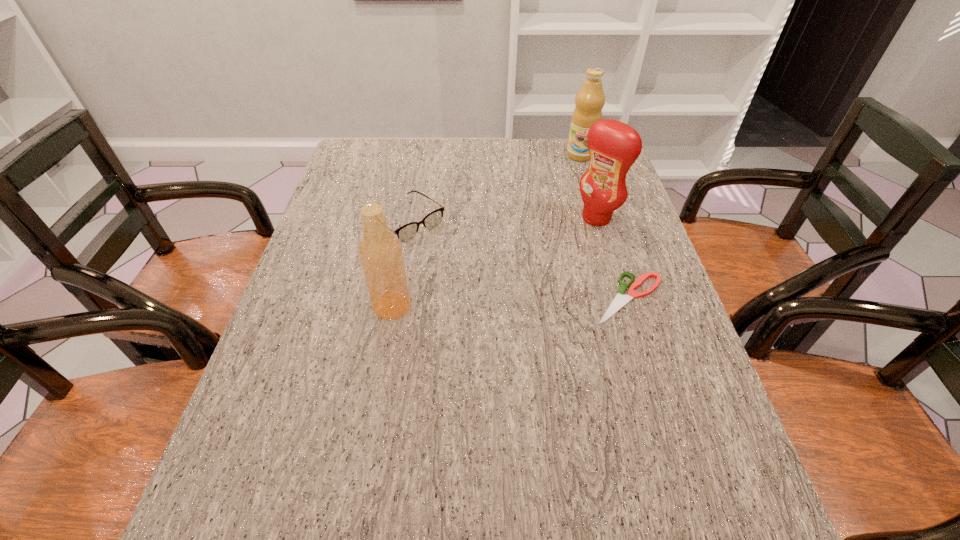
The width and height of the screenshot is (960, 540). In order to click on vacant area that lies between the farthest object and the shortest object in this screenshot , I will do `click(605, 227)`.

I want to click on vacant space that's between the fourth tallest object and the farthest object, so click(x=493, y=188).

In order to click on vacant point located between the fourth tallest object and the olive oil in this screenshot , I will do `click(493, 188)`.

In order to click on free space between the olive oil and the second shortest object in this screenshot , I will do `click(493, 188)`.

The image size is (960, 540). Identify the location of free point between the scissors and the farthest object. (605, 227).

This screenshot has height=540, width=960. I want to click on free spot between the olive oil and the beer bottle, so click(486, 231).

Find the location of a particular element. The width and height of the screenshot is (960, 540). object that stands as the fourth closest to the second shortest object is located at coordinates (590, 99).

Locate which object is the second closest to the olive oil. Please provide its 2D coordinates. Your answer should be formatted as a tuple, i.e. [(x, y)], where the tuple contains the x and y coordinates of a point satisfying the conditions above.

[(407, 232)]

Locate an element on the screen. vacant area in the image that satisfies the following two spatial constraints: 1. on the back side of the condiment; 2. on the left side of the fourth tallest object is located at coordinates (408, 218).

You are a GUI agent. You are given a task and a screenshot of the screen. Output one action in this format:
    pyautogui.click(x=<x>, y=<y>)
    Task: Click on the free spot that satisfies the following two spatial constraints: 1. on the back side of the beer bottle; 2. on the left side of the shortest object
    This screenshot has height=540, width=960.
    Given the screenshot: What is the action you would take?
    pyautogui.click(x=394, y=298)